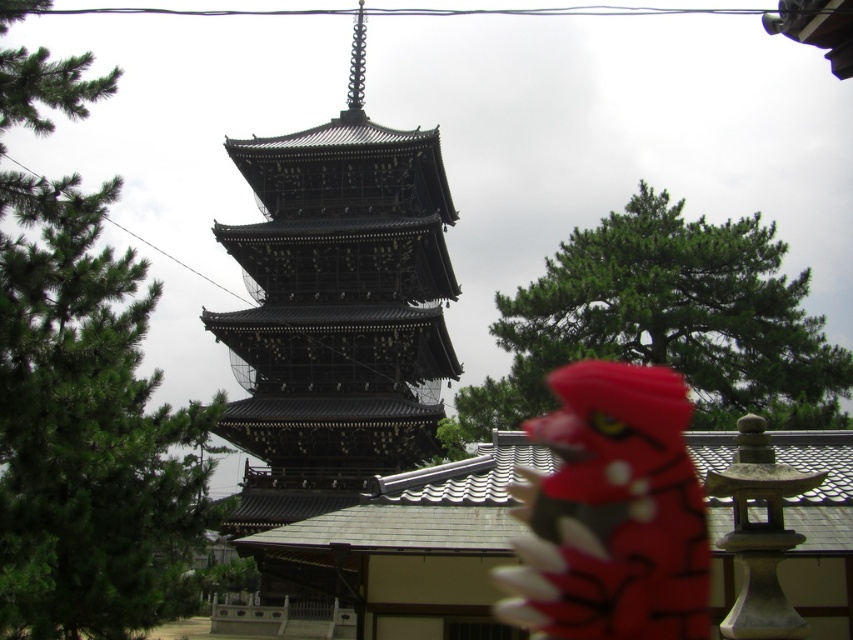
Does point (309, 230) come behind point (624, 621)?

That is True.

At what (x,y) coordinates should I click in order to perform the action: click on black lacquered pagoda at center. Please return your answer as a coordinate pair (x, y). This screenshot has width=853, height=640. Looking at the image, I should click on (335, 308).

Is green textured tree at upper center taller than matte plastic dragon at lower right?

Indeed, green textured tree at upper center has a greater height compared to matte plastic dragon at lower right.

Does green textured tree at upper center appear over matte plastic dragon at lower right?

Yes.

Identify the location of green textured tree at upper center. (666, 323).

This screenshot has width=853, height=640. I want to click on green textured tree at upper center, so pos(666,323).

Which is behind, point (167, 580) or point (639, 456)?

The point (167, 580) is more distant.

In the scene shown: Can you confirm if green matte tree at upper left is taller than matte plastic dragon at lower right?

Correct, green matte tree at upper left is much taller as matte plastic dragon at lower right.

Find the location of a particular element. This screenshot has width=853, height=640. green matte tree at upper left is located at coordinates (88, 432).